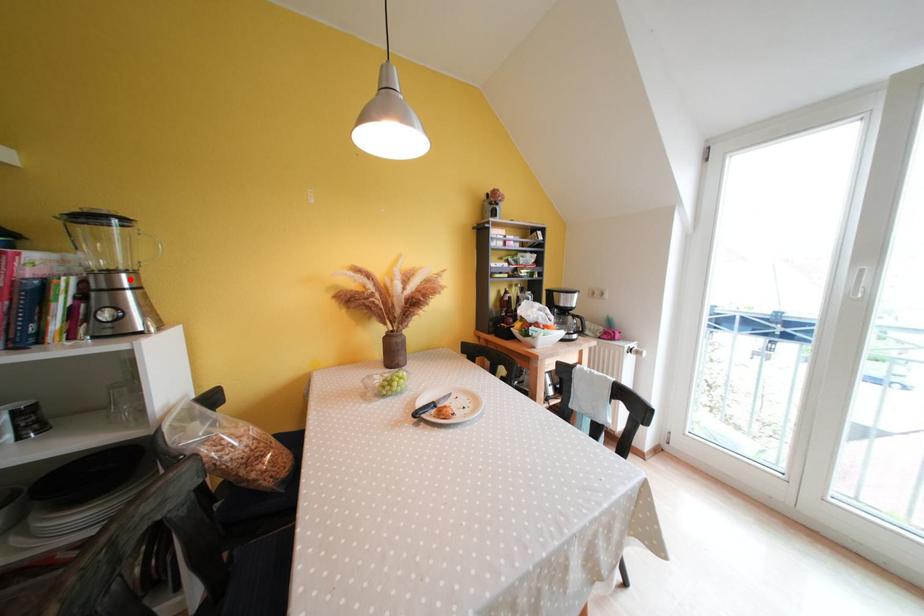
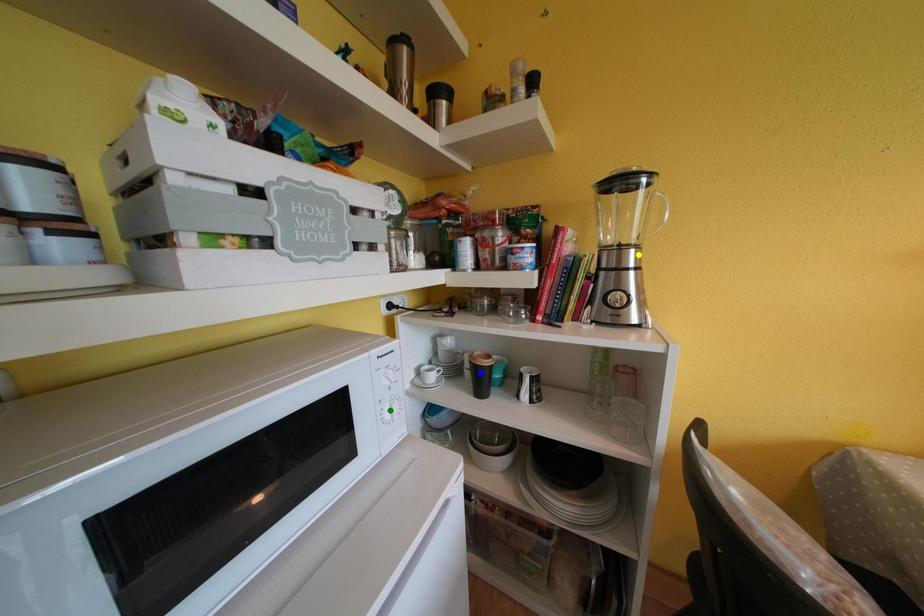
Question: I am providing you with two images of the same scene from different viewpoints. A red point is marked on the first image. You are given multiple points on the second image. Which mark in image 2 goes with the point in image 1?

Choices:
 (A) blue point
 (B) yellow point
 (C) green point

Answer: (B)